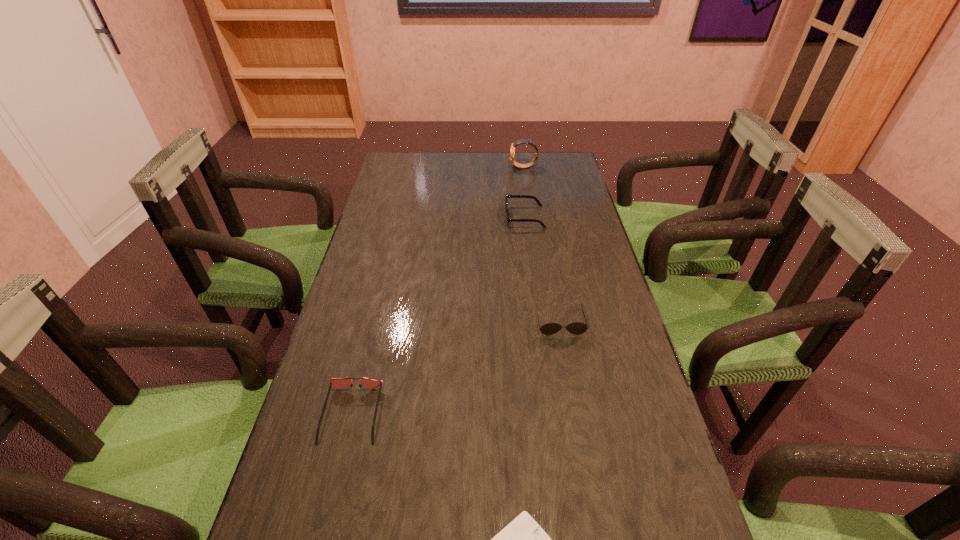
In the image, there is a desktop. At what (x,y) coordinates should I click in order to perform the action: click on vacant space at the right edge. Please return your answer as a coordinate pair (x, y). Looking at the image, I should click on (690, 521).

Locate an element on the screen. The image size is (960, 540). free space at the far left corner of the desktop is located at coordinates (401, 165).

Locate an element on the screen. vacant space in between the leftmost sunglasses and the fourth nearest object is located at coordinates (439, 315).

Identify the location of free space that is in between the second nearest sunglasses and the leftmost sunglasses. (456, 368).

Where is `free space between the leftmost object and the third nearest object`? Image resolution: width=960 pixels, height=540 pixels. free space between the leftmost object and the third nearest object is located at coordinates (456, 368).

What are the coordinates of `unoccupied position between the watch and the farthest sunglasses` in the screenshot? It's located at (524, 192).

You are a GUI agent. You are given a task and a screenshot of the screen. Output one action in this format:
    pyautogui.click(x=<x>, y=<y>)
    Task: Click on the vacant area that lies between the second nearest object and the farthest object
    This screenshot has height=540, width=960.
    Given the screenshot: What is the action you would take?
    pyautogui.click(x=438, y=291)

This screenshot has width=960, height=540. In order to click on vacant area that lies between the farthest object and the third nearest object in this screenshot , I will do `click(542, 245)`.

Locate an element on the screen. The height and width of the screenshot is (540, 960). the fourth closest object to the shortest object is located at coordinates (522, 141).

Where is `the fourth closest object to the fourth farthest object`? The image size is (960, 540). the fourth closest object to the fourth farthest object is located at coordinates (522, 141).